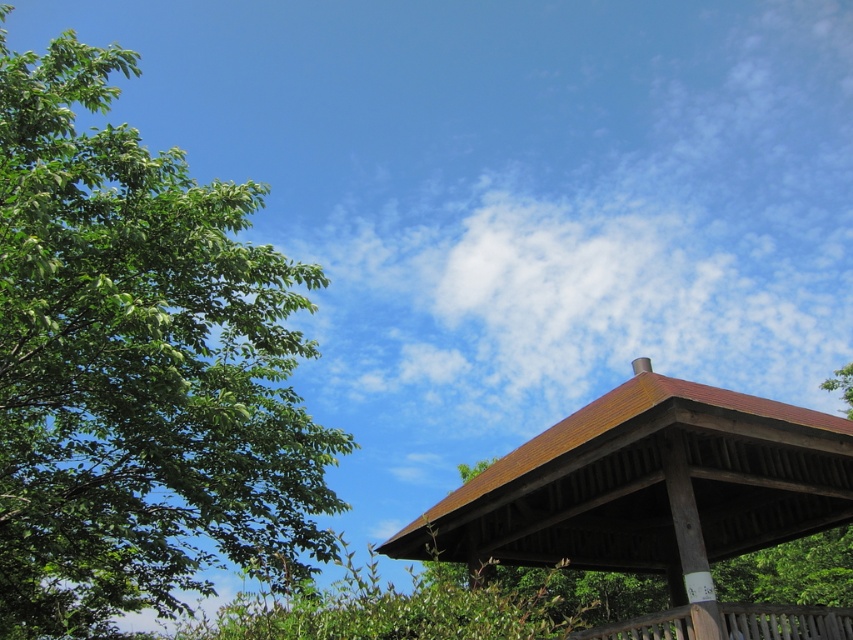
Question: Does green leafy tree at left have a lesser width compared to brown wooden gazebo at center?

Choices:
 (A) no
 (B) yes

Answer: (A)

Question: Which of the following is the farthest from the observer?

Choices:
 (A) green leafy tree at left
 (B) brown wooden gazebo at center

Answer: (B)

Question: Does green leafy tree at left have a larger size compared to brown wooden gazebo at center?

Choices:
 (A) yes
 (B) no

Answer: (A)

Question: Which of the following is the closest to the observer?

Choices:
 (A) brown wooden gazebo at center
 (B) green leafy tree at left

Answer: (B)

Question: Can you confirm if green leafy tree at left is positioned to the left of brown wooden gazebo at center?

Choices:
 (A) yes
 (B) no

Answer: (A)